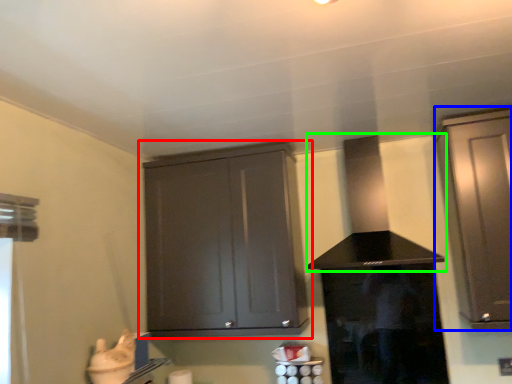
Question: Which is nearer to the cabinetry (highlighted by a red box)? cabinetry (highlighted by a blue box) or vent (highlighted by a green box).

Choices:
 (A) cabinetry
 (B) vent

Answer: (B)